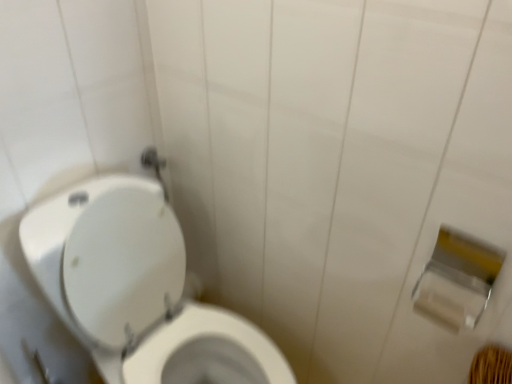
Question: From a real-world perspective, does white matte toilet paper at right, positioned as the 1th toilet paper in bottom-to-top order, stand above silver metallic toilet paper at right, the second toilet paper ordered from the bottom?

Choices:
 (A) yes
 (B) no

Answer: (B)

Question: Considering the relative sizes of white matte toilet paper at right, positioned as the 2th toilet paper in top-to-bottom order, and silver metallic toilet paper at right, the second toilet paper ordered from the bottom, in the image provided, is white matte toilet paper at right, positioned as the 2th toilet paper in top-to-bottom order, bigger than silver metallic toilet paper at right, the second toilet paper ordered from the bottom,?

Choices:
 (A) yes
 (B) no

Answer: (B)

Question: Is white matte toilet paper at right, positioned as the 1th toilet paper in bottom-to-top order, wider than silver metallic toilet paper at right, arranged as the first toilet paper when viewed from the top?

Choices:
 (A) yes
 (B) no

Answer: (B)

Question: Would you consider white matte toilet paper at right, positioned as the 1th toilet paper in bottom-to-top order, to be distant from silver metallic toilet paper at right, the second toilet paper ordered from the bottom?

Choices:
 (A) no
 (B) yes

Answer: (A)

Question: Would you say white matte toilet paper at right, positioned as the 1th toilet paper in bottom-to-top order, is outside silver metallic toilet paper at right, arranged as the first toilet paper when viewed from the top?

Choices:
 (A) yes
 (B) no

Answer: (B)

Question: Does white matte toilet paper at right, positioned as the 1th toilet paper in bottom-to-top order, appear on the right side of silver metallic toilet paper at right, arranged as the first toilet paper when viewed from the top?

Choices:
 (A) no
 (B) yes

Answer: (A)

Question: Are white glossy toilet at left and white matte toilet paper at right, positioned as the 1th toilet paper in bottom-to-top order, located far from each other?

Choices:
 (A) no
 (B) yes

Answer: (A)

Question: Considering the relative sizes of white glossy toilet at left and white matte toilet paper at right, positioned as the 2th toilet paper in top-to-bottom order, in the image provided, is white glossy toilet at left wider than white matte toilet paper at right, positioned as the 2th toilet paper in top-to-bottom order,?

Choices:
 (A) no
 (B) yes

Answer: (B)

Question: Is white glossy toilet at left taller than white matte toilet paper at right, positioned as the 2th toilet paper in top-to-bottom order?

Choices:
 (A) no
 (B) yes

Answer: (B)

Question: Is white glossy toilet at left oriented away from white matte toilet paper at right, positioned as the 1th toilet paper in bottom-to-top order?

Choices:
 (A) yes
 (B) no

Answer: (B)

Question: Is white glossy toilet at left not inside white matte toilet paper at right, positioned as the 1th toilet paper in bottom-to-top order?

Choices:
 (A) no
 (B) yes

Answer: (B)

Question: Can you confirm if white glossy toilet at left is shorter than white matte toilet paper at right, positioned as the 1th toilet paper in bottom-to-top order?

Choices:
 (A) no
 (B) yes

Answer: (A)

Question: Can you confirm if white glossy toilet at left is shorter than silver metallic toilet paper at right, arranged as the first toilet paper when viewed from the top?

Choices:
 (A) yes
 (B) no

Answer: (B)